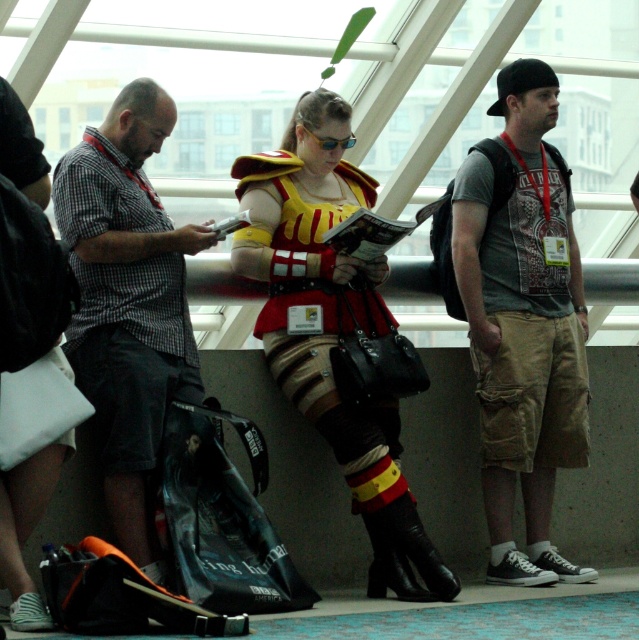
Question: Among these points, which one is farthest from the camera?

Choices:
 (A) (495, 278)
 (B) (440, 582)
 (C) (73, 324)

Answer: (A)

Question: Which point is closer to the camera?

Choices:
 (A) matte red armor at center
 (B) khaki cargo shorts at right
 (C) checkered fabric shirt at left

Answer: (C)

Question: Which object is farther from the camera taking this photo?

Choices:
 (A) checkered fabric shirt at left
 (B) khaki cargo shorts at right

Answer: (B)

Question: Does khaki cargo shorts at right have a lesser width compared to matte red armor at center?

Choices:
 (A) no
 (B) yes

Answer: (B)

Question: From the image, what is the correct spatial relationship of khaki cargo shorts at right in relation to checkered fabric shirt at left?

Choices:
 (A) below
 (B) above

Answer: (B)

Question: Is khaki cargo shorts at right to the right of checkered fabric shirt at left from the viewer's perspective?

Choices:
 (A) yes
 (B) no

Answer: (A)